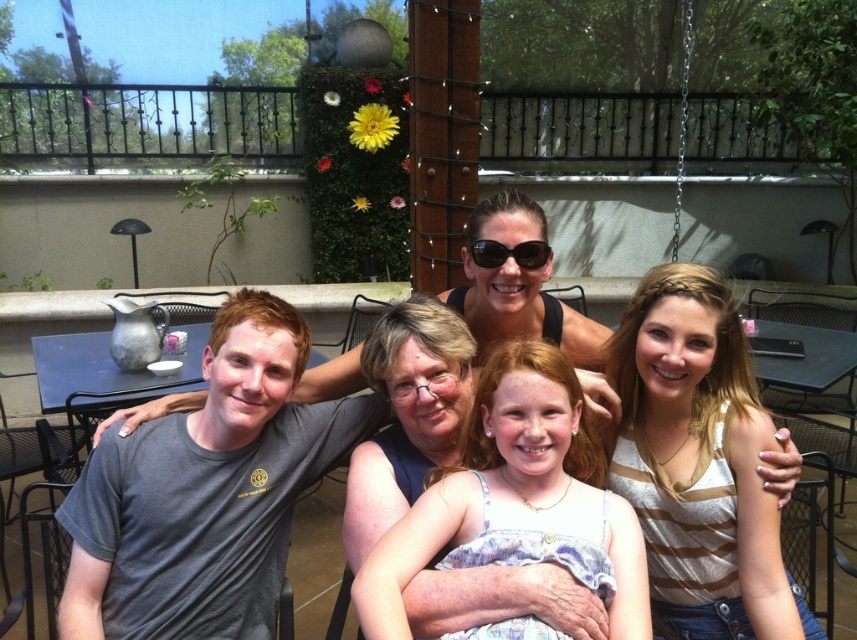
Which is more to the right, striped cotton shirt at center or black plastic sunglasses at center?

Positioned to the right is striped cotton shirt at center.

Does striped cotton shirt at center have a greater width compared to black plastic sunglasses at center?

Yes.

Which is in front, point (745, 490) or point (496, 241)?

Positioned in front is point (745, 490).

Image resolution: width=857 pixels, height=640 pixels. Identify the location of striped cotton shirt at center. (699, 464).

Does gray cotton t-shirt at left appear on the left side of light blue denim dress at center?

Yes, gray cotton t-shirt at left is to the left of light blue denim dress at center.

Between gray cotton t-shirt at left and light blue denim dress at center, which one is positioned lower?

light blue denim dress at center is below.

The width and height of the screenshot is (857, 640). What do you see at coordinates (207, 492) in the screenshot?
I see `gray cotton t-shirt at left` at bounding box center [207, 492].

Find the location of a particular element. The image size is (857, 640). gray cotton t-shirt at left is located at coordinates (207, 492).

The width and height of the screenshot is (857, 640). What do you see at coordinates (207, 492) in the screenshot?
I see `gray cotton t-shirt at left` at bounding box center [207, 492].

At what (x,y) coordinates should I click in order to perform the action: click on gray cotton t-shirt at left. Please return your answer as a coordinate pair (x, y). The width and height of the screenshot is (857, 640). Looking at the image, I should click on (207, 492).